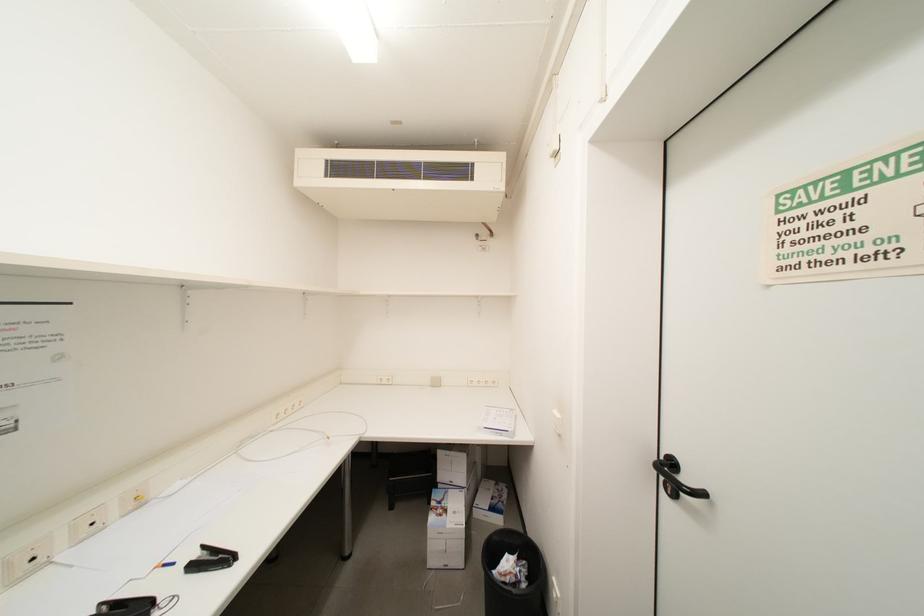
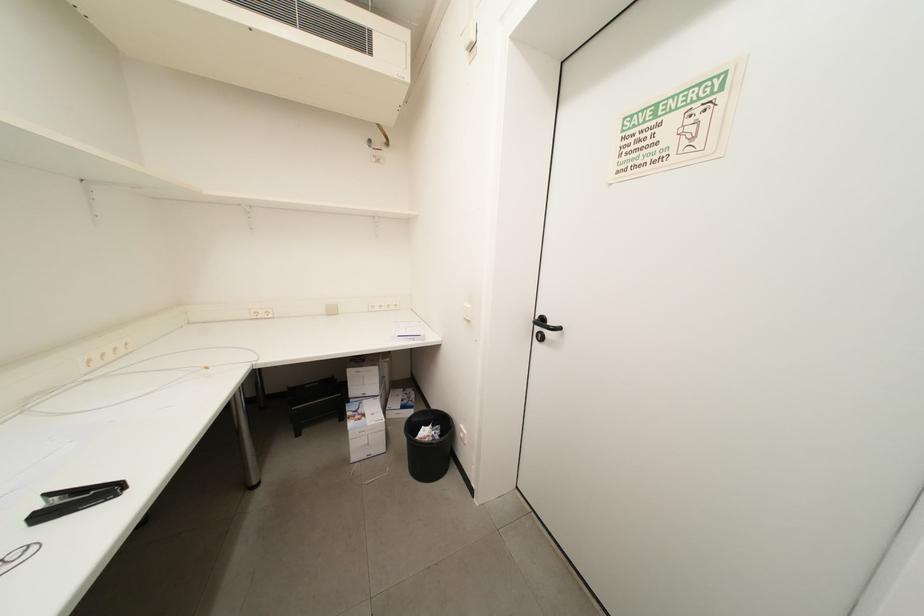
Question: Which direction would the cameraman need to move to produce the second image? Reply with the corresponding letter.

Choices:
 (A) Left
 (B) Right
 (C) Forward
 (D) Backward

Answer: (A)